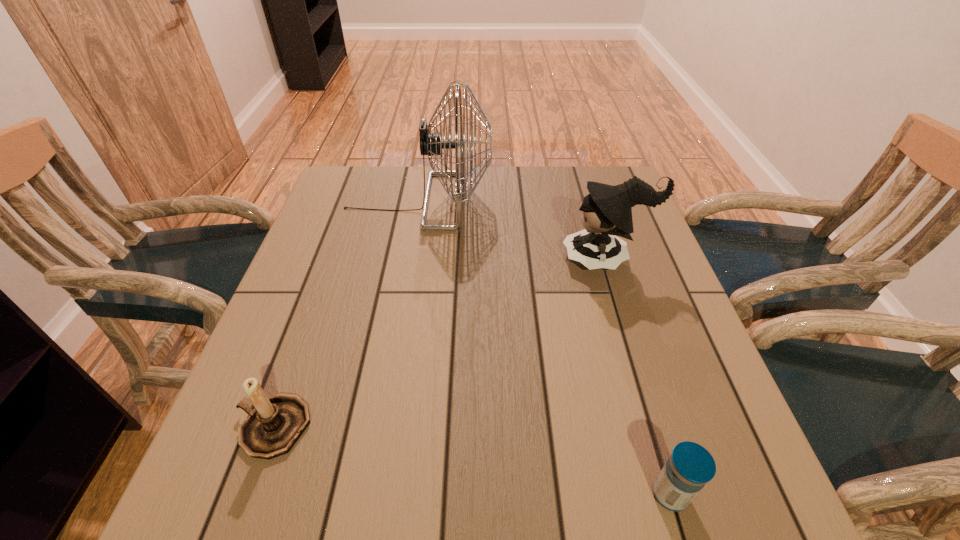
Identify the location of object located in the far left corner section of the desktop. This screenshot has height=540, width=960. (431, 144).

The height and width of the screenshot is (540, 960). What are the coordinates of `object positioned at the near right corner` in the screenshot? It's located at (690, 466).

What are the coordinates of `free region at the far edge of the desktop` in the screenshot? It's located at (408, 165).

This screenshot has width=960, height=540. In order to click on free space at the near edge in this screenshot , I will do `click(612, 492)`.

Locate an element on the screen. The image size is (960, 540). vacant space at the left edge of the desktop is located at coordinates (350, 302).

This screenshot has width=960, height=540. I want to click on vacant space at the right edge of the desktop, so click(x=650, y=420).

Identify the location of free space at the near right corner of the desktop. (751, 504).

Locate an element on the screen. blank region between the medicine and the third shortest object is located at coordinates (638, 377).

Image resolution: width=960 pixels, height=540 pixels. I want to click on unoccupied position between the fan and the medicine, so click(x=544, y=348).

This screenshot has height=540, width=960. What are the coordinates of `blank region between the candle holder and the medicine` in the screenshot? It's located at (471, 461).